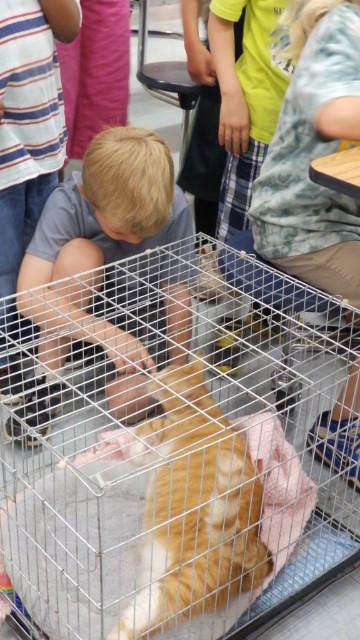
Question: Is silver wire bird cage at center positioned before light brown hair at center?

Choices:
 (A) yes
 (B) no

Answer: (A)

Question: Does light brown hair at center appear under orange fur cat at center?

Choices:
 (A) no
 (B) yes

Answer: (A)

Question: Which is farther from the light brown hair at center?

Choices:
 (A) silver wire bird cage at center
 (B) orange fur cat at center

Answer: (B)

Question: Which object is positioned closest to the orange fur cat at center?

Choices:
 (A) silver wire bird cage at center
 (B) light brown hair at center

Answer: (A)

Question: Based on their relative distances, which object is nearer to the light brown hair at center?

Choices:
 (A) silver wire bird cage at center
 (B) orange fur cat at center

Answer: (A)

Question: Is light brown hair at center bigger than orange fur cat at center?

Choices:
 (A) no
 (B) yes

Answer: (B)